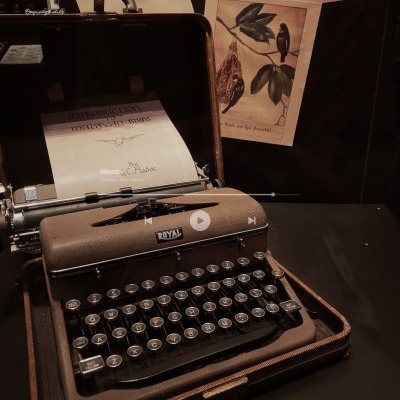
Identify the location of c key on the typewriter. This screenshot has height=400, width=400. (154, 343).